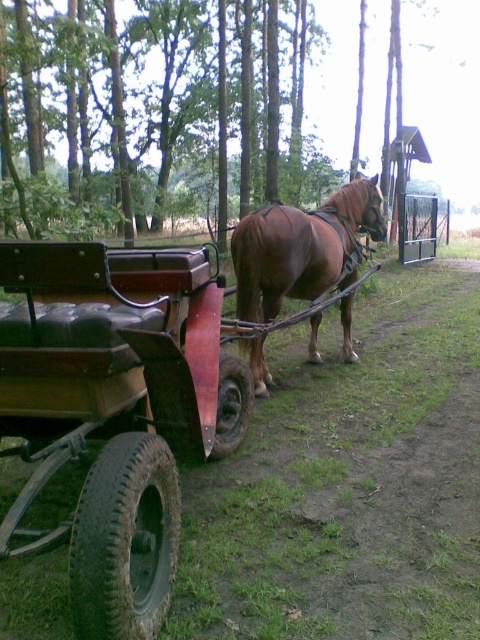
Question: Which point appears closest to the camera in this image?

Choices:
 (A) (116, 512)
 (B) (252, 320)

Answer: (A)

Question: Considering the relative positions of wooden/leather wagon at center-left and brown glossy horse at center in the image provided, where is wooden/leather wagon at center-left located with respect to brown glossy horse at center?

Choices:
 (A) left
 (B) right

Answer: (A)

Question: Can you confirm if wooden/leather wagon at center-left is smaller than brown glossy horse at center?

Choices:
 (A) yes
 (B) no

Answer: (A)

Question: Does wooden/leather wagon at center-left appear on the left side of brown glossy horse at center?

Choices:
 (A) no
 (B) yes

Answer: (B)